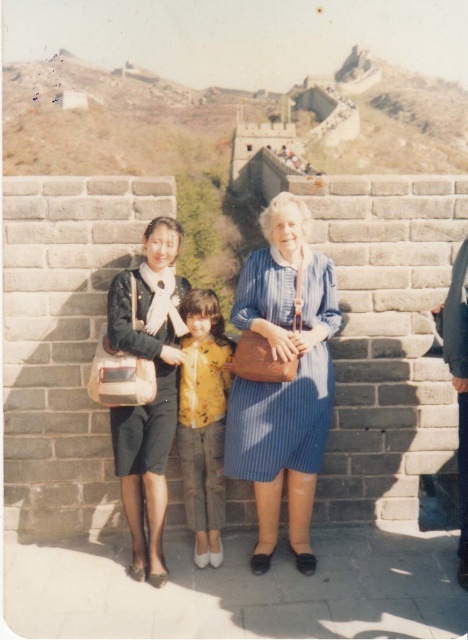
You are a photographer trying to capture a group photo of the matte blue dress at center and the yellow matte shirt at center. Since you want to ensure both are in focus, you need to know which one is taller. Can you tell me which one is taller?

The matte blue dress at center is taller than the yellow matte shirt at center, so you should adjust your camera settings to focus on the taller object first.